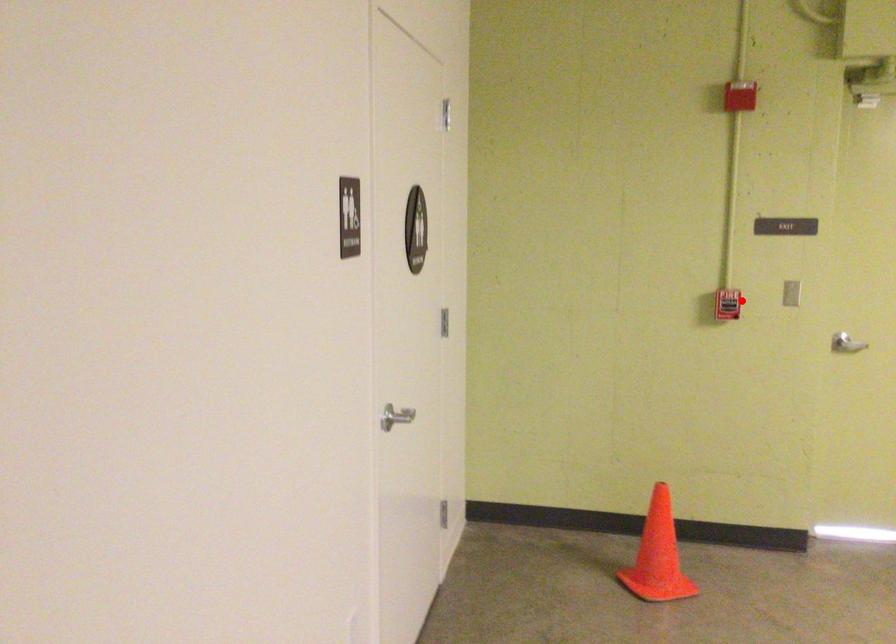
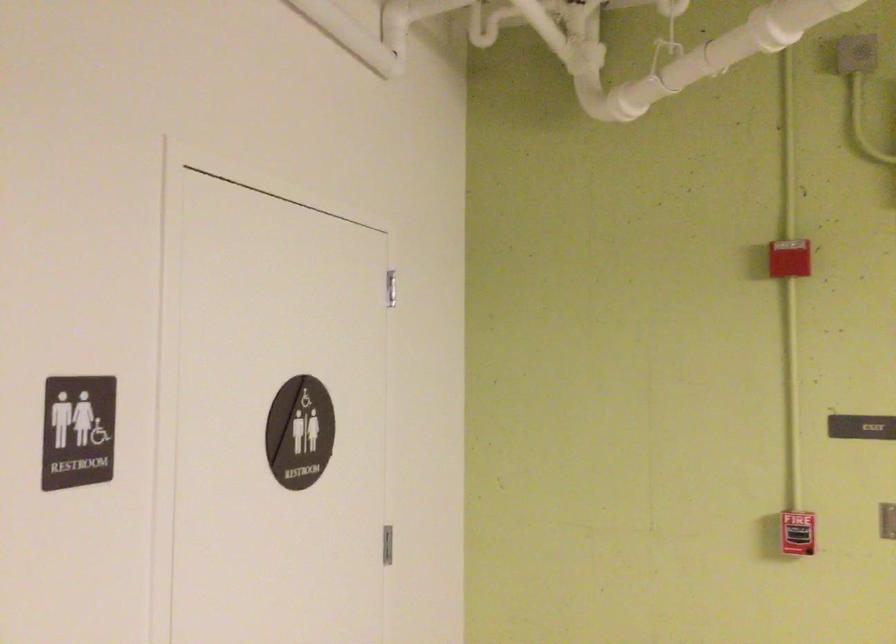
The point at the highlighted location is marked in the first image. Where is the corresponding point in the second image?

(797, 533)